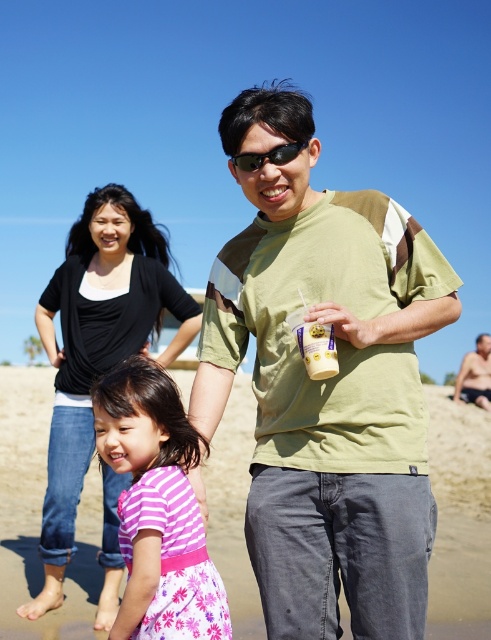
Question: Does pink floral dress at center have a lesser width compared to black plastic sunglasses at center?

Choices:
 (A) yes
 (B) no

Answer: (B)

Question: Does green cotton shirt at center appear on the left side of black plastic sunglasses at center?

Choices:
 (A) yes
 (B) no

Answer: (B)

Question: Which of the following is the closest to the observer?

Choices:
 (A) (355, 218)
 (B) (22, 524)

Answer: (A)

Question: Based on their relative distances, which object is nearer to the black plastic sunglasses at center?

Choices:
 (A) green cotton shirt at center
 (B) skinny man at right

Answer: (A)

Question: Is pink floral dress at center positioned in front of skinny man at right?

Choices:
 (A) yes
 (B) no

Answer: (A)

Question: Which is farther from the fine-grained sand at lower center?

Choices:
 (A) skinny man at right
 (B) black plastic sunglasses at center
 (C) black cotton shirt at upper left

Answer: (A)